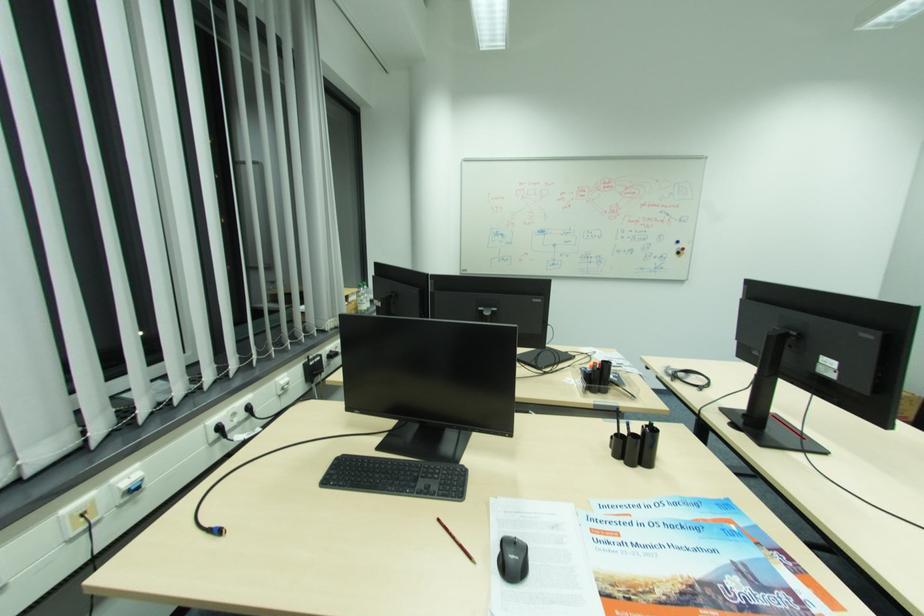
Locate an element on the screen. This screenshot has width=924, height=616. black computer mouse is located at coordinates pos(513,559).